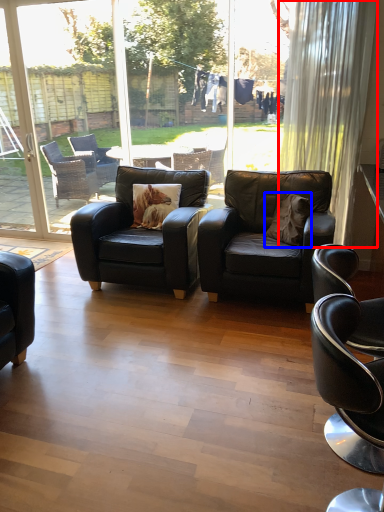
Question: Which object is closer to the camera taking this photo, curtain (highlighted by a red box) or pillow (highlighted by a blue box)?

Choices:
 (A) curtain
 (B) pillow

Answer: (B)